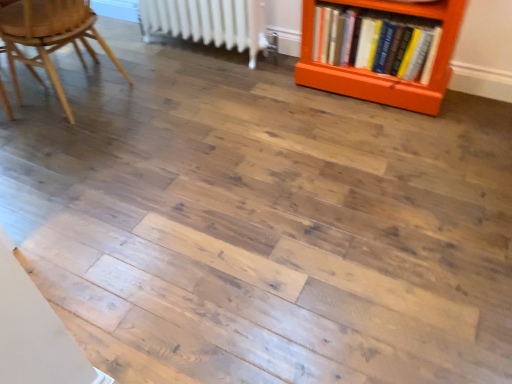
Question: From the image's perspective, would you say white metallic radiator at upper center is shown under hardcover books at right?

Choices:
 (A) no
 (B) yes

Answer: (A)

Question: Considering the relative sizes of white metallic radiator at upper center and hardcover books at right in the image provided, is white metallic radiator at upper center taller than hardcover books at right?

Choices:
 (A) no
 (B) yes

Answer: (B)

Question: Considering the relative sizes of white metallic radiator at upper center and hardcover books at right in the image provided, is white metallic radiator at upper center wider than hardcover books at right?

Choices:
 (A) yes
 (B) no

Answer: (B)

Question: Can you see white metallic radiator at upper center touching hardcover books at right?

Choices:
 (A) yes
 (B) no

Answer: (B)

Question: Can you confirm if white metallic radiator at upper center is thinner than hardcover books at right?

Choices:
 (A) yes
 (B) no

Answer: (A)

Question: Considering the positions of wooden chair at left and white metallic radiator at upper center in the image, is wooden chair at left wider or thinner than white metallic radiator at upper center?

Choices:
 (A) thin
 (B) wide

Answer: (B)

Question: Would you say wooden chair at left is to the left or to the right of white metallic radiator at upper center in the picture?

Choices:
 (A) right
 (B) left

Answer: (B)

Question: Is wooden chair at left in front of or behind white metallic radiator at upper center in the image?

Choices:
 (A) front
 (B) behind

Answer: (A)

Question: Do you think wooden chair at left is within white metallic radiator at upper center, or outside of it?

Choices:
 (A) inside
 (B) outside

Answer: (B)

Question: Is point click(244, 13) positioned closer to the camera than point click(14, 8)?

Choices:
 (A) farther
 (B) closer

Answer: (A)

Question: Based on their positions, is white metallic radiator at upper center located to the left or right of wooden chair at left?

Choices:
 (A) left
 (B) right

Answer: (B)

Question: From a real-world perspective, relative to wooden chair at left, is white metallic radiator at upper center vertically above or below?

Choices:
 (A) above
 (B) below

Answer: (B)

Question: In the image, is white metallic radiator at upper center positioned in front of or behind wooden chair at left?

Choices:
 (A) front
 (B) behind

Answer: (B)

Question: From the image's perspective, is white metallic radiator at upper center above or below hardcover books at right?

Choices:
 (A) below
 (B) above

Answer: (B)

Question: Is white metallic radiator at upper center in front of or behind hardcover books at right in the image?

Choices:
 (A) front
 (B) behind

Answer: (B)